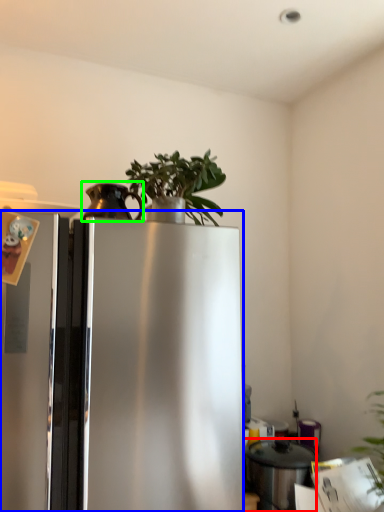
Question: Which is nearer to the appliance (highlighted by a red box)? refrigerator (highlighted by a blue box) or appliance (highlighted by a green box).

Choices:
 (A) refrigerator
 (B) appliance

Answer: (A)